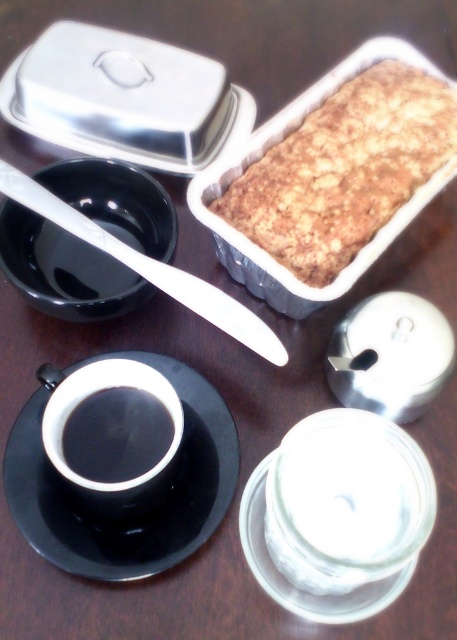
You are a guest at a breakfast table and want to take a piece of the golden crumbly bread at center. The white plastic knife at upper left is needed to cut it. Can you reach the knife without moving the bread?

The white plastic knife at upper left is behind the golden crumbly bread at center, so you can reach it without moving the bread.

What are the coordinates of the black glossy saucer at upper left?

The coordinates of the black glossy saucer at upper left are at point (64,269).

You are standing at the point with coordinates (64, 269). Which object are you on?

You are on the black glossy saucer at upper left.